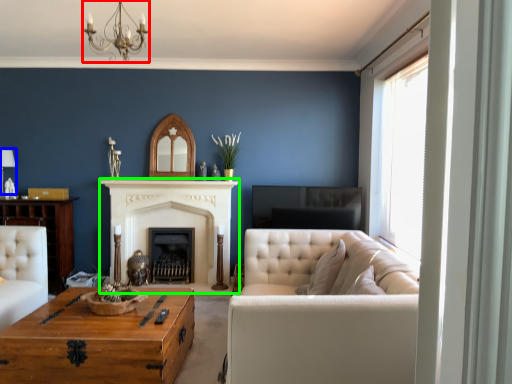
Question: Which object is the closest to the light fixture (highlighted by a red box)? Choose among these: lamp (highlighted by a blue box) or fireplace (highlighted by a green box).

Choices:
 (A) lamp
 (B) fireplace

Answer: (A)